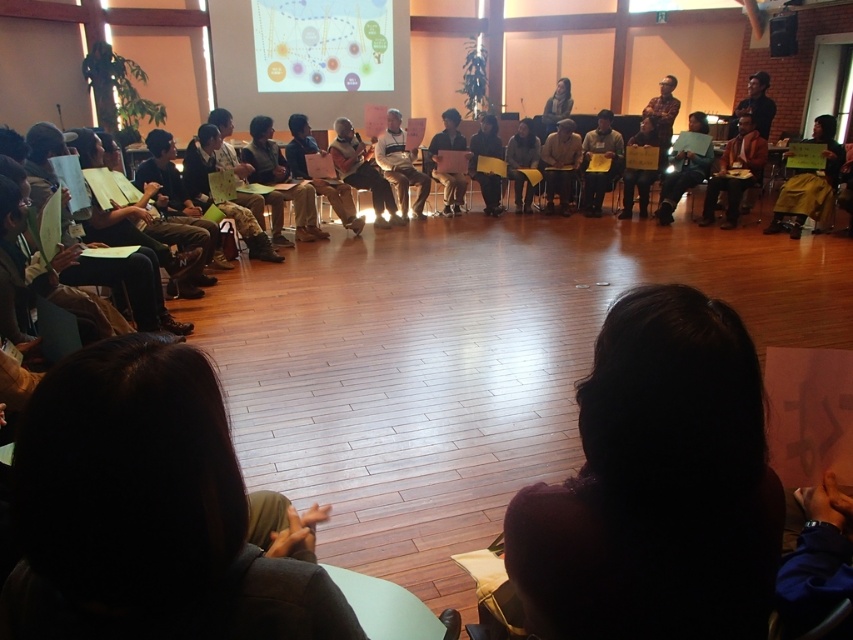
Is point (144, 234) closer to viewer compared to point (271, 246)?

Yes.

Between matte black laptop at left and camouflage pants at center, which one is positioned lower?

matte black laptop at left

Describe the element at coordinates (149, 246) in the screenshot. I see `matte black laptop at left` at that location.

Find the location of a particular element. matte black laptop at left is located at coordinates (149, 246).

Can you confirm if black fabric shirt at center is shorter than matte black shirt at upper right?

In fact, black fabric shirt at center may be taller than matte black shirt at upper right.

You are a GUI agent. You are given a task and a screenshot of the screen. Output one action in this format:
    pyautogui.click(x=<x>, y=<y>)
    Task: Click on the black fabric shirt at center
    The height and width of the screenshot is (640, 853).
    Given the screenshot: What is the action you would take?
    pyautogui.click(x=601, y=157)

Can you confirm if dark brown leather jacket at center is positioned to the left of dark gray sweater at center?

In fact, dark brown leather jacket at center is to the right of dark gray sweater at center.

Which is below, dark brown leather jacket at center or dark gray sweater at center?

dark brown leather jacket at center is below.

What do you see at coordinates (682, 179) in the screenshot? This screenshot has width=853, height=640. I see `dark brown leather jacket at center` at bounding box center [682, 179].

Where is `dark brown leather jacket at center`? Image resolution: width=853 pixels, height=640 pixels. dark brown leather jacket at center is located at coordinates (682, 179).